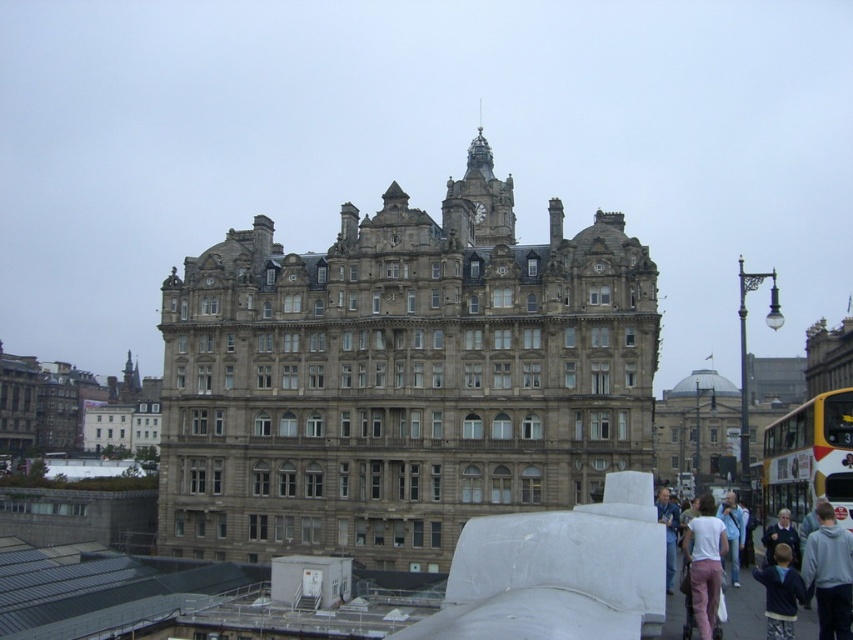
Question: Which point appears farthest from the camera in this image?

Choices:
 (A) (668, 545)
 (B) (778, 608)
 (C) (817, 472)
 (D) (798, 544)

Answer: (C)

Question: Which object appears farthest from the camera in this image?

Choices:
 (A) gray hoodie at lower right
 (B) dark blue jacket at lower right
 (C) white cotton shirt at lower right

Answer: (B)

Question: Where is yellowmaterial bus at right located in relation to dark blue jacket at lower right in the image?

Choices:
 (A) right
 (B) left

Answer: (A)

Question: Which object is closer to the camera taking this photo?

Choices:
 (A) white cotton shirt at lower right
 (B) dark blue jacket at lower right

Answer: (A)

Question: Is the position of gray hoodie at lower right more distant than that of dark blue jacket at lower right?

Choices:
 (A) yes
 (B) no

Answer: (B)

Question: Does yellowmaterial bus at right come in front of white cotton shirt at lower right?

Choices:
 (A) yes
 (B) no

Answer: (B)